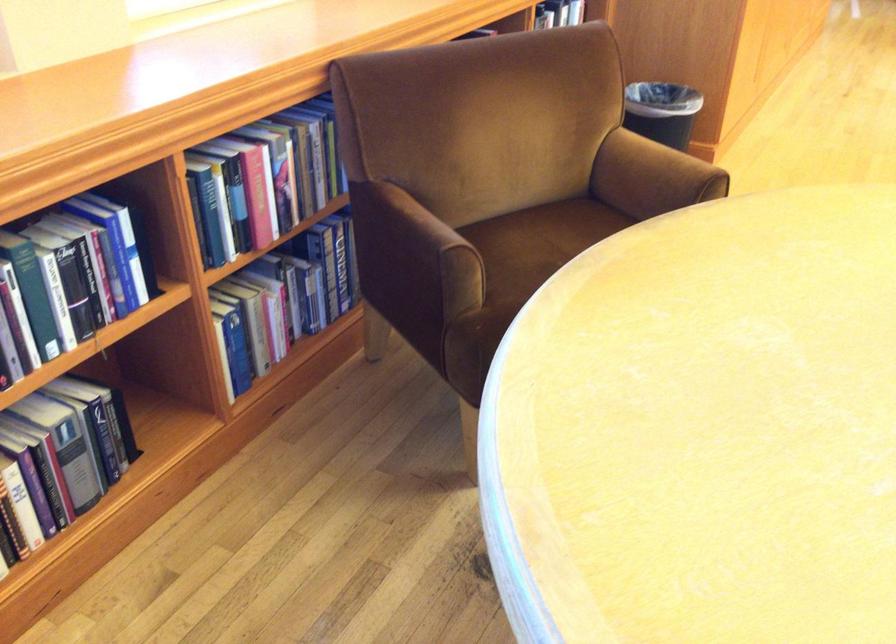
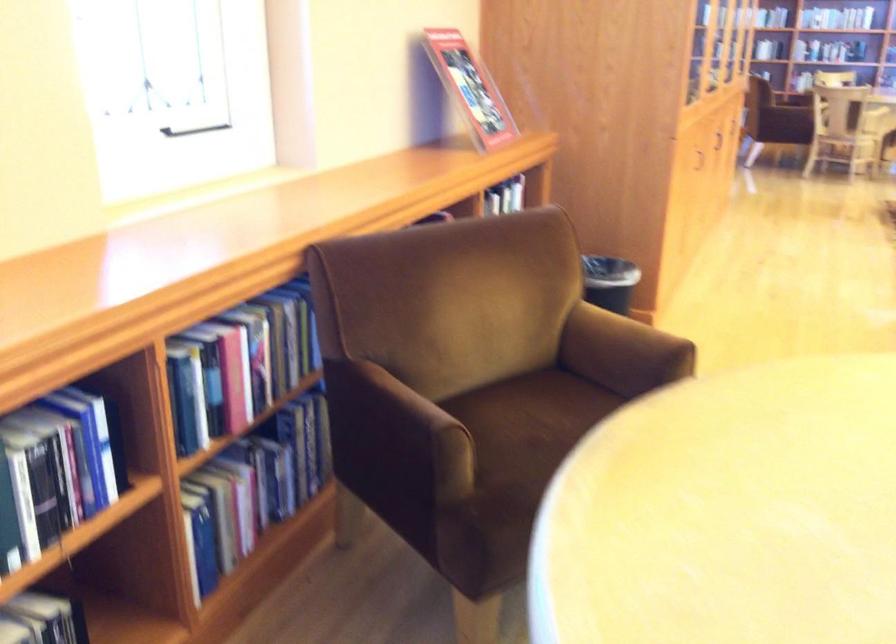
The point at (256, 190) is marked in the first image. Where is the corresponding point in the second image?

(234, 375)